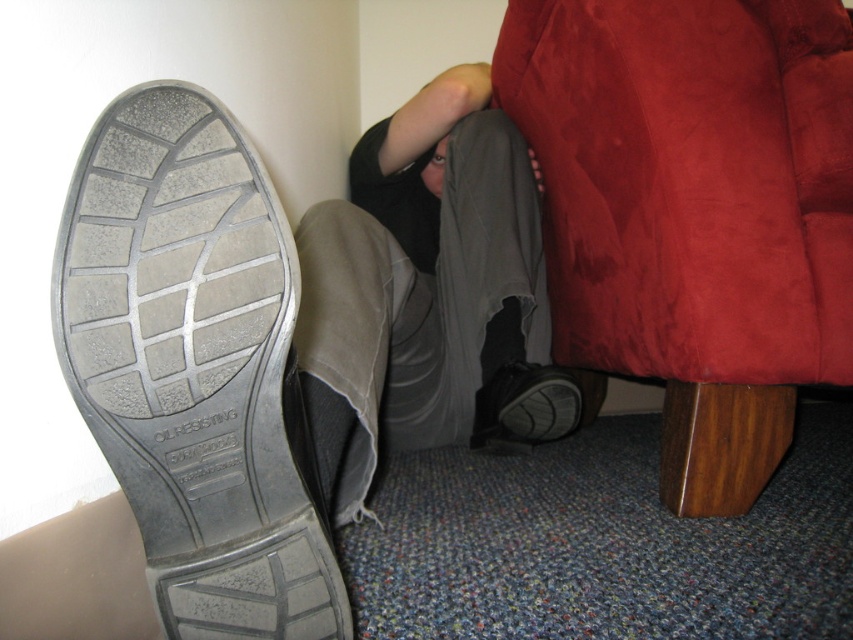
Question: From the image, what is the correct spatial relationship of suede-like red armchair at lower right in relation to smooth skin head at upper center?

Choices:
 (A) right
 (B) left

Answer: (A)

Question: Does matte gray shoe at lower right appear on the left side of smooth skin head at upper center?

Choices:
 (A) no
 (B) yes

Answer: (A)

Question: Among these points, which one is farthest from the camera?

Choices:
 (A) (572, 406)
 (B) (276, 490)
 (C) (440, 189)

Answer: (C)

Question: Which point is closer to the camera?

Choices:
 (A) (558, 97)
 (B) (427, 156)
 (C) (529, 426)

Answer: (A)

Question: Is gray rubber shoe at lower left smaller than smooth skin head at upper center?

Choices:
 (A) no
 (B) yes

Answer: (A)

Question: Which object is the closest to the smooth skin head at upper center?

Choices:
 (A) suede-like red armchair at lower right
 (B) gray rubber shoe at lower left
 (C) matte gray shoe at lower right

Answer: (C)